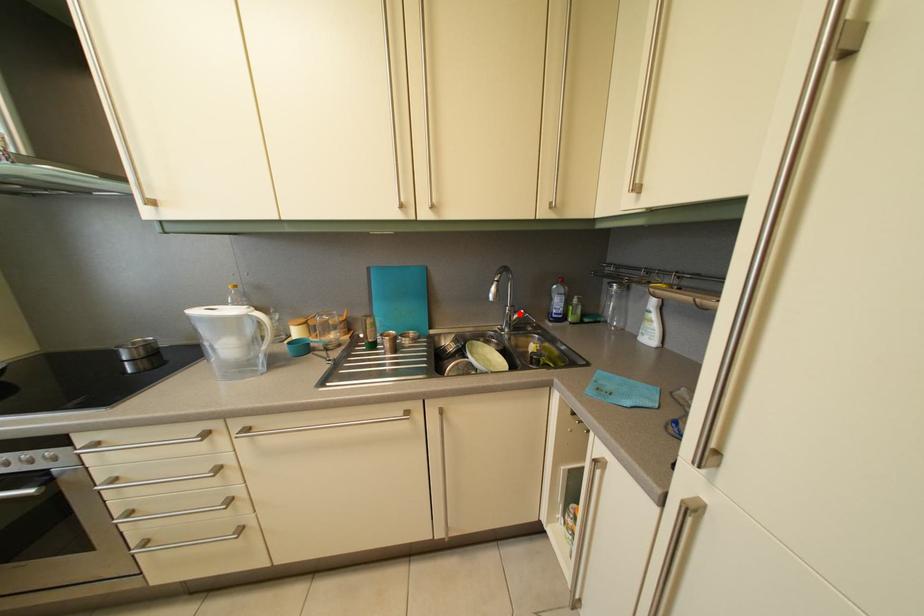
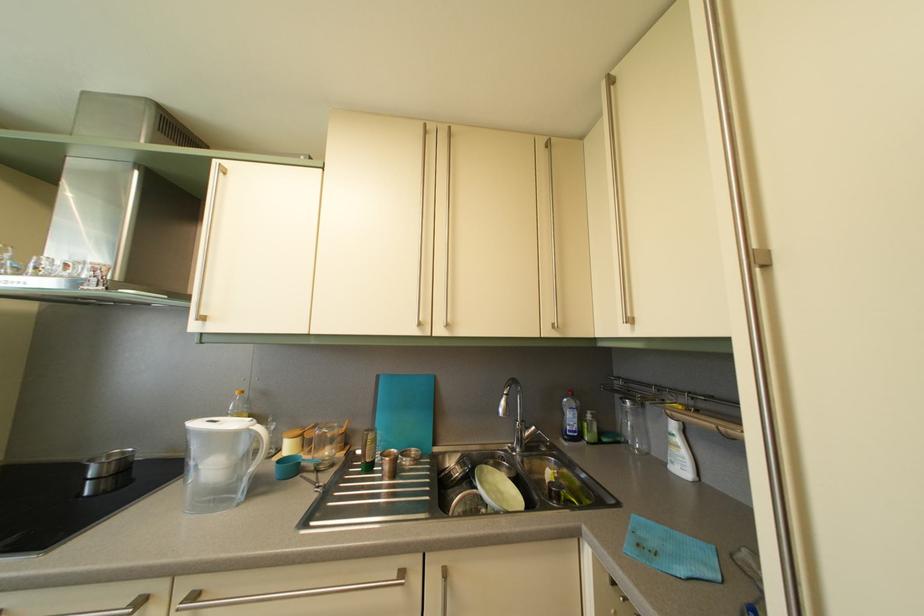
Find the pixel in the second image that matches the highlighted location in the first image.

(530, 429)